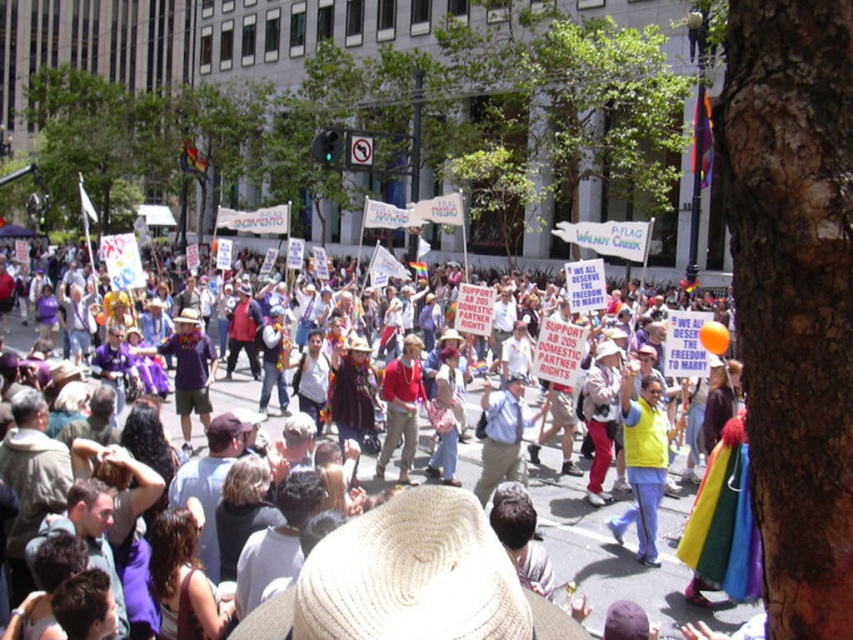
You are a participant in the parade and want to move from your current position to the front of the crowd. Which point should you move towards, point [271,417] or point [421,397]?

You should move towards point [421,397] because point [271,417] is behind point [421,397], meaning it is further away from the front of the crowd.

You are a photographer standing at the back of the crowd. You want to take a photo of the red matte shirt at center and the white straw cowboy hat at center. However, you notice that one of the objects is blocking your view. Which object is blocking the other?

The white straw cowboy hat at center is in front of the red matte shirt at center, so the white straw cowboy hat at center is blocking the view of the red matte shirt at center.